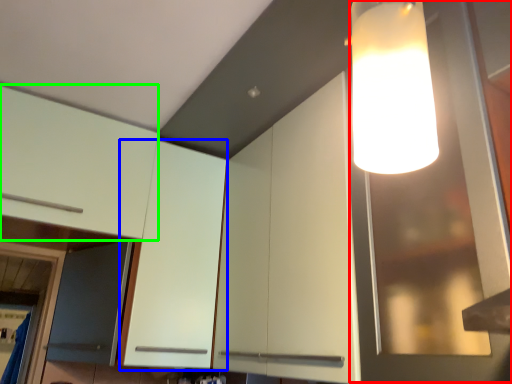
Question: Which is nearer to the glass door (highlighted by a red box)? cabinetry (highlighted by a blue box) or cabinetry (highlighted by a green box).

Choices:
 (A) cabinetry
 (B) cabinetry

Answer: (A)